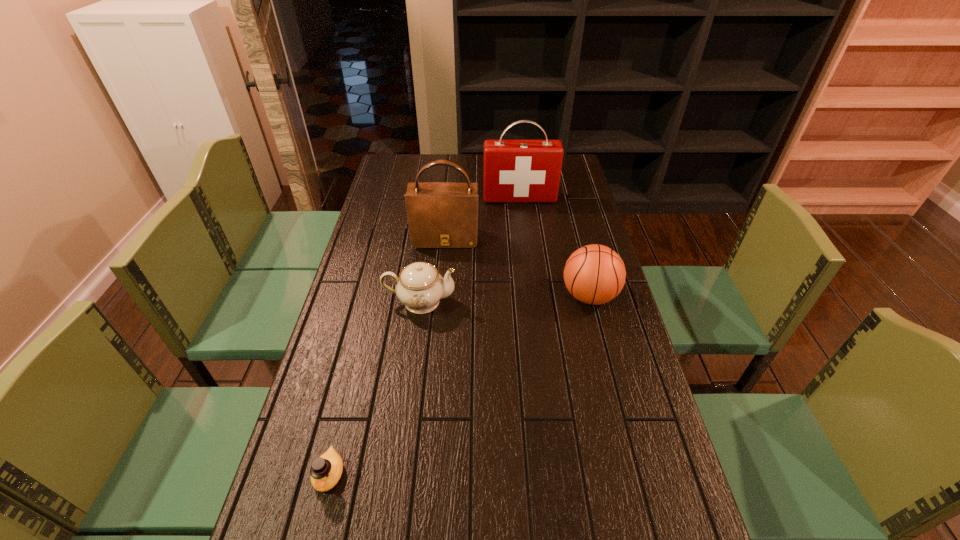
You are a GUI agent. You are given a task and a screenshot of the screen. Output one action in this format:
    pyautogui.click(x=<x>, y=<y>)
    Task: Click on the vacant space located 0.060m on the front-facing side of the duck
    This screenshot has width=960, height=540.
    Given the screenshot: What is the action you would take?
    pyautogui.click(x=316, y=529)

Identify the location of chinaware at the left edge. The height and width of the screenshot is (540, 960). (420, 286).

Where is `duck located in the left edge section of the desktop`? The width and height of the screenshot is (960, 540). duck located in the left edge section of the desktop is located at coordinates (x=325, y=471).

You are a GUI agent. You are given a task and a screenshot of the screen. Output one action in this format:
    pyautogui.click(x=<x>, y=<y>)
    Task: Click on the first-aid kit that is at the right edge
    The width and height of the screenshot is (960, 540).
    Given the screenshot: What is the action you would take?
    pyautogui.click(x=515, y=171)

Identify the location of basketball present at the right edge. (594, 274).

Locate an element on the screen. The height and width of the screenshot is (540, 960). free space at the far edge of the desktop is located at coordinates (437, 180).

The width and height of the screenshot is (960, 540). What are the coordinates of `free space at the left edge of the desktop` in the screenshot? It's located at (398, 200).

Locate an element on the screen. free spot at the right edge of the desktop is located at coordinates (645, 514).

Find the location of a particular element. The width and height of the screenshot is (960, 540). vacant space at the far left corner of the desktop is located at coordinates (389, 160).

The image size is (960, 540). Identify the location of free space between the first-aid kit and the shoulder bag. (483, 219).